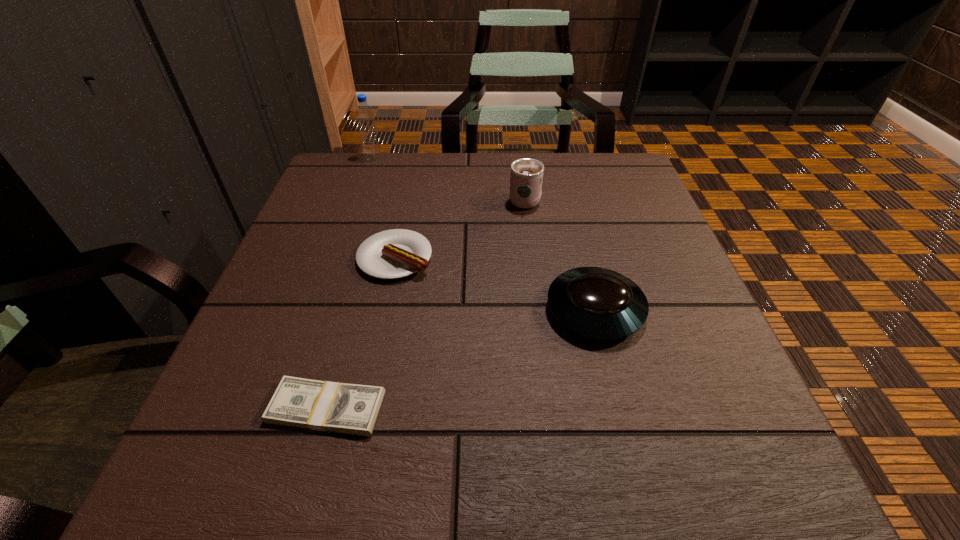
Identify the location of object situated at the right edge. (598, 303).

This screenshot has width=960, height=540. I want to click on object present at the far left corner, so click(364, 114).

At what (x,y) coordinates should I click in order to perform the action: click on object located in the near left corner section of the desktop. Please return your answer as a coordinate pair (x, y). Looking at the image, I should click on (345, 408).

Locate an element on the screen. vacant space at the far edge of the desktop is located at coordinates (446, 165).

Where is `vacant region at the left edge of the desktop`? This screenshot has width=960, height=540. vacant region at the left edge of the desktop is located at coordinates click(x=320, y=269).

Locate an element on the screen. The image size is (960, 540). free space at the right edge of the desktop is located at coordinates (586, 206).

The height and width of the screenshot is (540, 960). In the image, there is a desktop. What are the coordinates of `vacant space at the far left corner` in the screenshot? It's located at (315, 188).

At what (x,y) coordinates should I click in order to perform the action: click on vacant space at the far right corner of the desktop. Please return your answer as a coordinate pair (x, y). The height and width of the screenshot is (540, 960). Looking at the image, I should click on (580, 165).

Locate an element on the screen. Image resolution: width=960 pixels, height=540 pixels. free space that is in between the tallest object and the second farthest object is located at coordinates click(448, 179).

I want to click on vacant area that lies between the sausage and the shortest object, so coord(361,333).